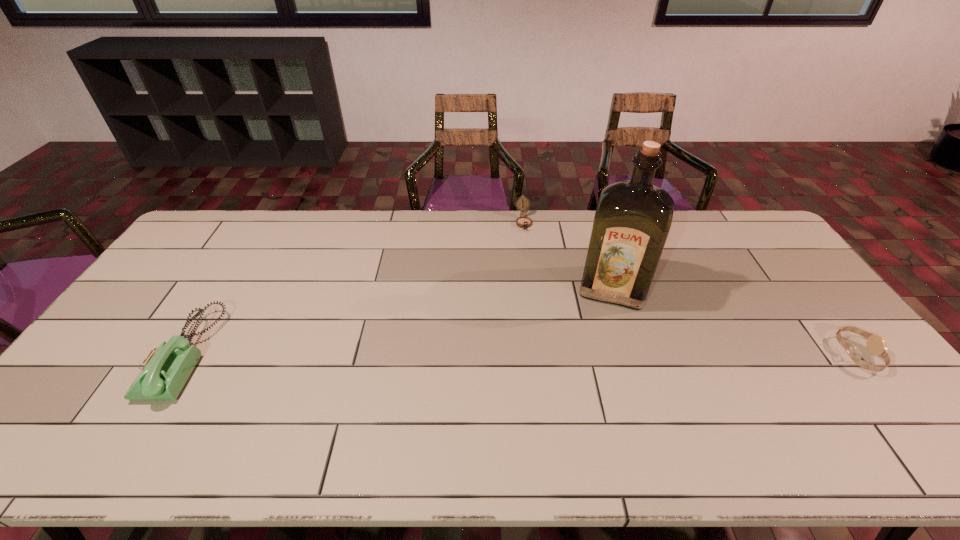
The height and width of the screenshot is (540, 960). Find the location of `vacant spot on the desktop that is between the leftmost object and the watch and is positioned on the label of the tallest object`. vacant spot on the desktop that is between the leftmost object and the watch and is positioned on the label of the tallest object is located at coordinates (601, 355).

Image resolution: width=960 pixels, height=540 pixels. I want to click on vacant space on the desktop that is between the telephone and the shortest object and is positioned on the face of the third object from right to left, so (545, 354).